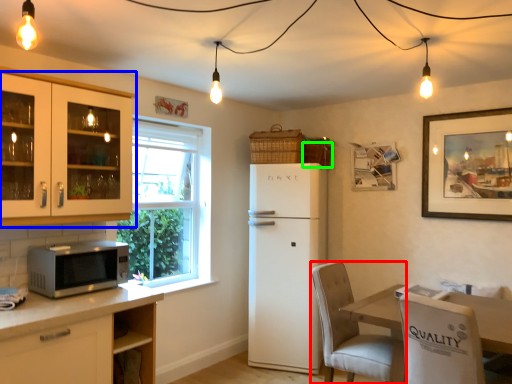
Question: Which is nearer to the chair (highlighted by a red box)? cabinetry (highlighted by a blue box) or basket (highlighted by a green box).

Choices:
 (A) cabinetry
 (B) basket

Answer: (B)